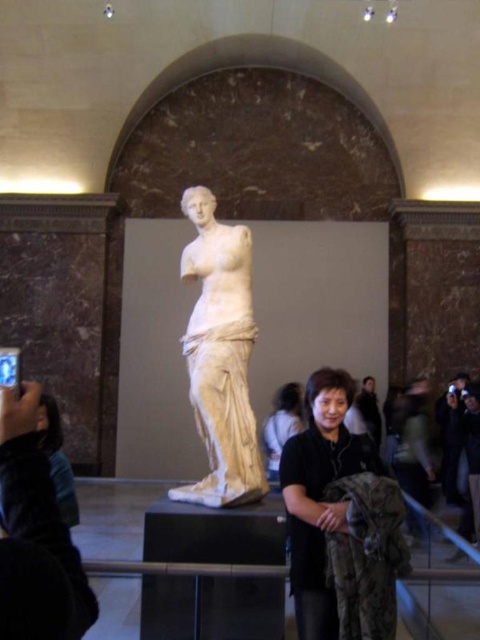
Looking at this image, you are an art student standing in front of the white marble statue at center and the matte black jacket at lower center. Which object is located to the right of the other?

The matte black jacket at lower center is located to the right of the white marble statue at center.

You are an art conservator tasked with placing a protective barrier around the white marble statue at center. The barrier must be placed at coordinates between 0.5 and 0.6 on the x and y axes. Can the barrier be positioned around the statue without overlapping it?

The white marble statue at center is located at point (220, 356). Since both coordinates fall within the 0.5 to 0.6 range, the barrier can be positioned around the statue without overlapping it.